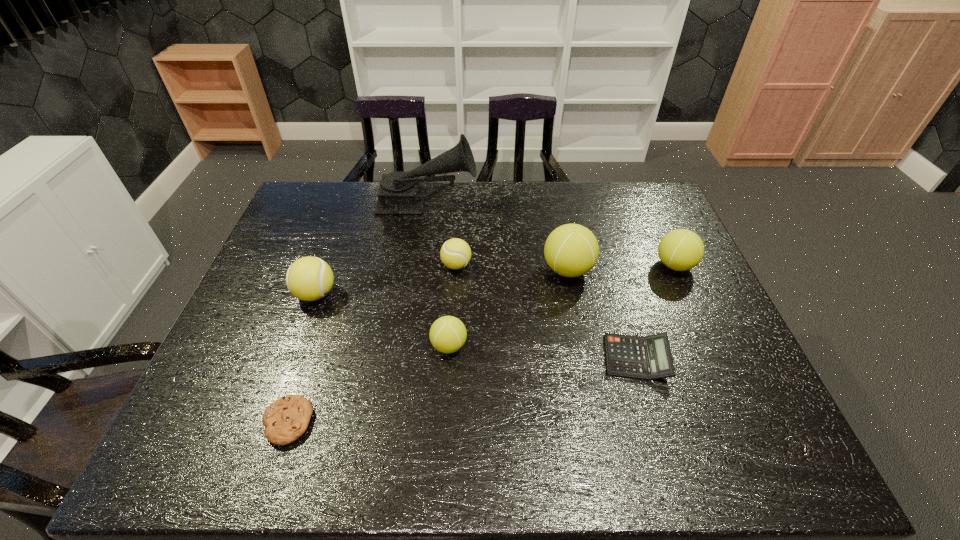
You are a GUI agent. You are given a task and a screenshot of the screen. Output one action in this format:
    pyautogui.click(x=<x>, y=<y>)
    Task: Click on the blank region between the leftmost green tennis ball and the right yellow tennis ball
    
    Given the screenshot: What is the action you would take?
    pyautogui.click(x=453, y=306)

At what (x,y) coordinates should I click in order to perform the action: click on empty space that is in between the second shortest object and the rightmost green tennis ball. Please return your answer as a coordinate pair (x, y). Image resolution: width=960 pixels, height=540 pixels. Looking at the image, I should click on (656, 312).

Image resolution: width=960 pixels, height=540 pixels. Find the location of `object that stands as the closest to the right yellow tennis ball`. object that stands as the closest to the right yellow tennis ball is located at coordinates (400, 192).

In order to click on object that stands as the third closest to the second smallest green tennis ball in this screenshot , I will do `click(455, 253)`.

Point out which tennis ball is positioned as the second nearest to the rightmost green tennis ball. Please provide its 2D coordinates. Your answer should be formatted as a tuple, i.e. [(x, y)], where the tuple contains the x and y coordinates of a point satisfying the conditions above.

[(455, 253)]

The height and width of the screenshot is (540, 960). I want to click on the second closest tennis ball to the smaller yellow tennis ball, so click(x=571, y=250).

The width and height of the screenshot is (960, 540). Find the location of `green tennis ball that is the second closest to the nearest tennis ball`. green tennis ball that is the second closest to the nearest tennis ball is located at coordinates (680, 250).

Identify the location of green tennis ball that is the second closest to the leftmost tennis ball. The height and width of the screenshot is (540, 960). (571, 250).

Where is `vacant area in the image that satisfies the following two spatial constraints: 1. on the back side of the cookie; 2. on the left side of the calculator`? The image size is (960, 540). vacant area in the image that satisfies the following two spatial constraints: 1. on the back side of the cookie; 2. on the left side of the calculator is located at coordinates (308, 358).

Image resolution: width=960 pixels, height=540 pixels. Identify the location of vacant area that satisfies the following two spatial constraints: 1. from the horn of the black phonograph_record; 2. on the right side of the smallest green tennis ball. (406, 346).